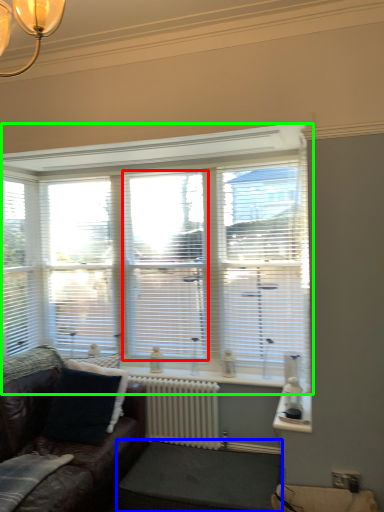
Question: Which is nearer to the glass door (highlighted by a red box)? footrest (highlighted by a blue box) or window (highlighted by a green box).

Choices:
 (A) footrest
 (B) window

Answer: (B)